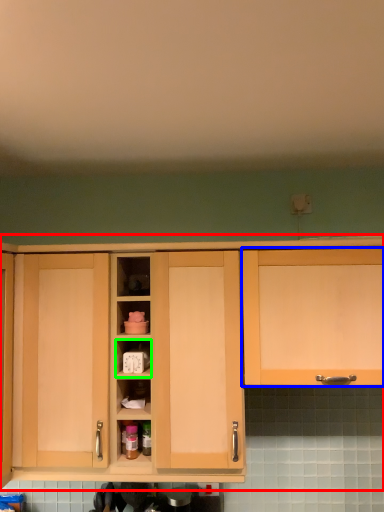
Question: Based on their relative distances, which object is farther from cabinetry (highlighted by a red box)? Choose from cabinetry (highlighted by a blue box) and cabinet (highlighted by a green box).

Choices:
 (A) cabinetry
 (B) cabinet

Answer: (B)